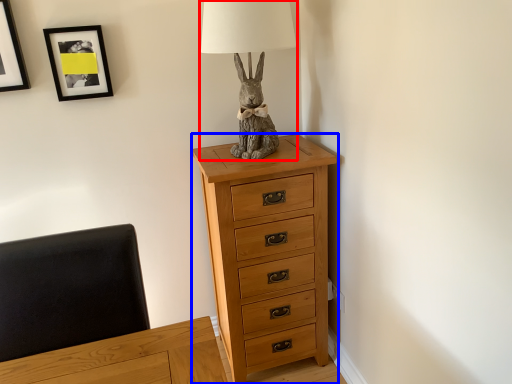
Question: Which object is further to the camera taking this photo, table lamp (highlighted by a red box) or chest of drawers (highlighted by a blue box)?

Choices:
 (A) table lamp
 (B) chest of drawers

Answer: (B)